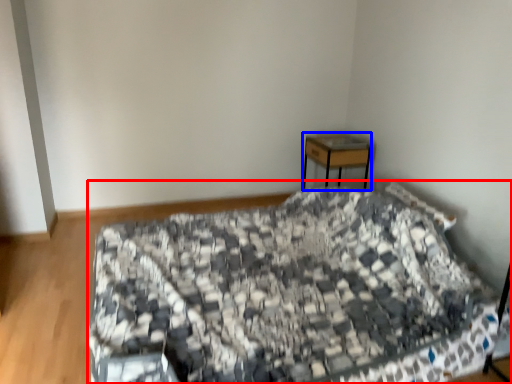
Question: Which object appears closest to the camera in this image, bed (highlighted by a red box) or desk (highlighted by a blue box)?

Choices:
 (A) bed
 (B) desk

Answer: (A)